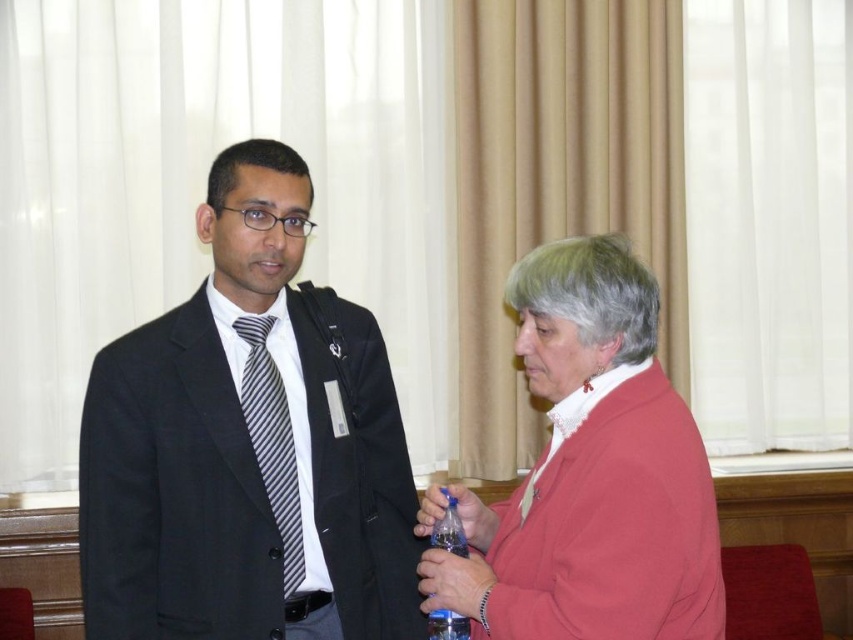
Does matte black suit at left appear over striped fabric tie at left?

Yes, matte black suit at left is above striped fabric tie at left.

Is matte black suit at left thinner than striped fabric tie at left?

No, matte black suit at left is not thinner than striped fabric tie at left.

The image size is (853, 640). What are the coordinates of `matte black suit at left` in the screenshot? It's located at (248, 445).

Can you confirm if matte black suit at left is taller than matte red jacket at right?

Yes.

Between matte black suit at left and matte red jacket at right, which one is positioned higher?

Positioned higher is matte black suit at left.

Describe the element at coordinates (248, 445) in the screenshot. This screenshot has height=640, width=853. I see `matte black suit at left` at that location.

Image resolution: width=853 pixels, height=640 pixels. I want to click on matte black suit at left, so click(248, 445).

Based on the photo, between matte red jacket at right and striped fabric tie at left, which one is positioned lower?

Positioned lower is striped fabric tie at left.

Which of these two, matte red jacket at right or striped fabric tie at left, stands shorter?

With less height is striped fabric tie at left.

Is point (676, 397) farther from camera compared to point (283, 529)?

No, it is not.

Identify the location of matte red jacket at right. This screenshot has width=853, height=640. (590, 474).